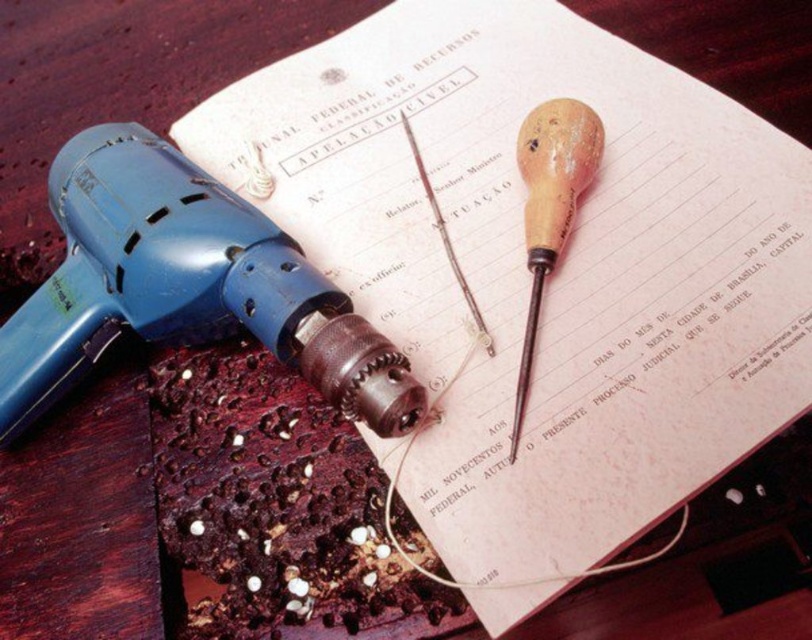
Question: Does blue plastic drill at left appear under wooden handle screwdriver at center?

Choices:
 (A) no
 (B) yes

Answer: (B)

Question: Does blue plastic drill at left appear under wooden handle screwdriver at center?

Choices:
 (A) yes
 (B) no

Answer: (A)

Question: Which point is farther to the camera?

Choices:
 (A) wooden handle screwdriver at center
 (B) blue plastic drill at left

Answer: (A)

Question: Which of the following is the closest to the observer?

Choices:
 (A) (387, 404)
 (B) (519, 164)

Answer: (A)

Question: Which of the following is the farthest from the observer?

Choices:
 (A) blue plastic drill at left
 (B) wooden handle screwdriver at center

Answer: (B)

Question: Does blue plastic drill at left have a smaller size compared to wooden handle screwdriver at center?

Choices:
 (A) no
 (B) yes

Answer: (A)